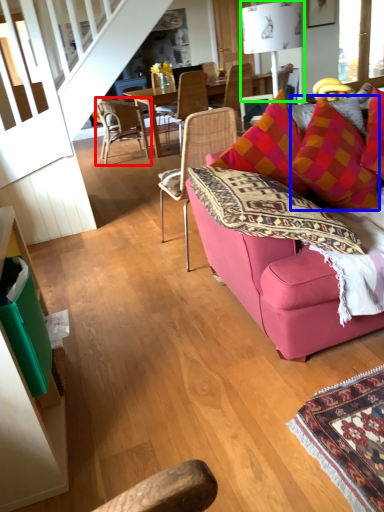
Question: Considering the real-world distances, which object is closest to chair (highlighted by a red box)? throw pillow (highlighted by a blue box) or lamp (highlighted by a green box).

Choices:
 (A) throw pillow
 (B) lamp

Answer: (B)